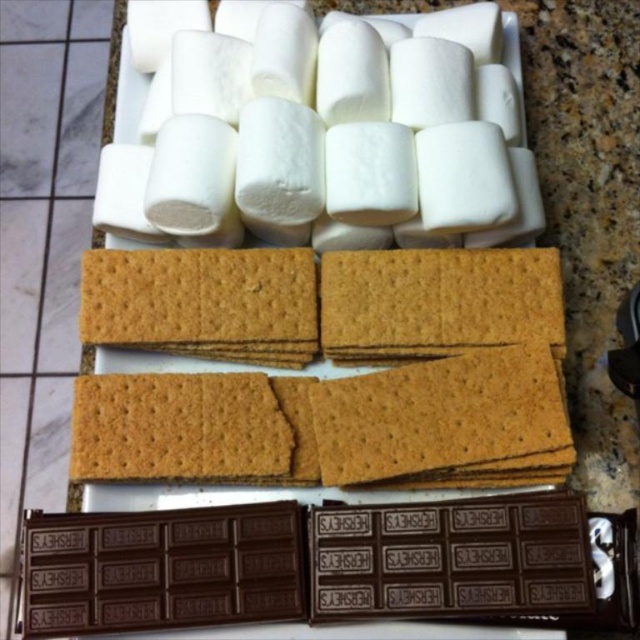
You are setting up a s mores station and need to know the arrangement of the ingredients. Which item is placed above the other between the white fluffy marshmallows at upper center and the dark chocolate bar at bottom?

The white fluffy marshmallows at upper center are positioned over the dark chocolate bar at bottom, so the marshmallows are above the chocolate bar.

You are a chef preparing s more and need to place the white fluffy marshmallows at upper center and dark chocolate bar at bottom on a tray. The minimum distance required between these items to prevent contamination is 20 inches. Can you safely place them as shown?

The white fluffy marshmallows at upper center is 21.56 inches away from dark chocolate bar at bottom, which exceeds the 20 inch requirement. Therefore, they can be safely placed as shown to prevent contamination.

You are preparing to make s more and need to access both the white fluffy marshmallows at upper center and the dark chocolate bar at bottom. From your current position in front of the tray, which item is closer to you?

The white fluffy marshmallows at upper center are closer to you since the dark chocolate bar at bottom is behind them.